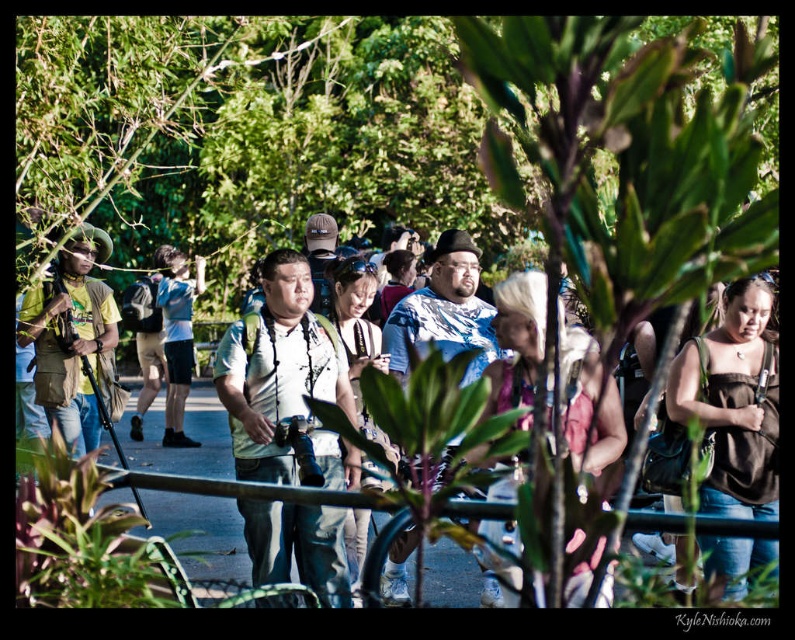
You are a photographer trying to capture a clear shot of the blue patterned shirt at center and the matte black backpack at center. Since the blurred plant with elongated, green leaves is in the foreground, which object might be easier to see through the leaves? Explain your reasoning based on their sizes.

The blue patterned shirt at center has a lesser height compared to the matte black backpack at center. Since the backpack is taller, it might be more visible above the obstructing leaves, making it easier to see through the plant.

You are standing at the blurred plant with elongated green leaves in the foreground of the park scene. You want to take a photo of both the point at coordinates point(474, 307) and point(153, 381) in the image. Which point should you focus on first to ensure both are in clear view?

You should focus on point(474, 307) first since it is closer to the viewer than point(153, 381). By focusing on the closer point, the farther point will also be in focus due to the depth of field.

You are a photographer trying to capture a clear shot of the people walking on the path. The blurred plant with elongated leaves is blocking your view. Which object, the blue denim shorts at center or the matte black backpack at center, would you need to move closer to the camera to ensure both are fully visible in the frame?

The blue denim shorts at center is narrower than the matte black backpack at center, so you should move the blue denim shorts at center closer to the camera to ensure both fit within the frame.